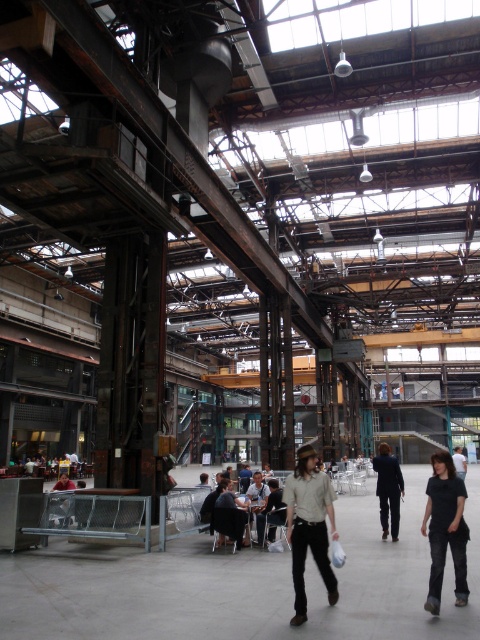
Does black cotton shirt at lower right appear under dark brown leather jacket at center?

Actually, black cotton shirt at lower right is above dark brown leather jacket at center.

Which is more to the right, black cotton shirt at lower right or dark brown leather jacket at center?

From the viewer's perspective, dark brown leather jacket at center appears more on the right side.

Is point (447, 512) positioned after point (456, 452)?

No, it is not.

Find the location of `black cotton shirt at lower right`. black cotton shirt at lower right is located at coordinates (444, 529).

Does khaki cotton shirt at center have a lesser height compared to dark brown leather jacket at center?

Yes, khaki cotton shirt at center is shorter than dark brown leather jacket at center.

Between khaki cotton shirt at center and dark brown leather jacket at center, which one has more height?

dark brown leather jacket at center

Identify the location of khaki cotton shirt at center. Image resolution: width=480 pixels, height=640 pixels. (309, 525).

Between khaki cotton shirt at center and light gray fabric bag at lower left, which one has less height?

khaki cotton shirt at center is shorter.

Can you confirm if khaki cotton shirt at center is positioned to the left of light gray fabric bag at lower left?

Incorrect, khaki cotton shirt at center is not on the left side of light gray fabric bag at lower left.

Where is `khaki cotton shirt at center`? This screenshot has width=480, height=640. khaki cotton shirt at center is located at coordinates (309, 525).

The image size is (480, 640). Find the location of `khaki cotton shirt at center`. khaki cotton shirt at center is located at coordinates (309, 525).